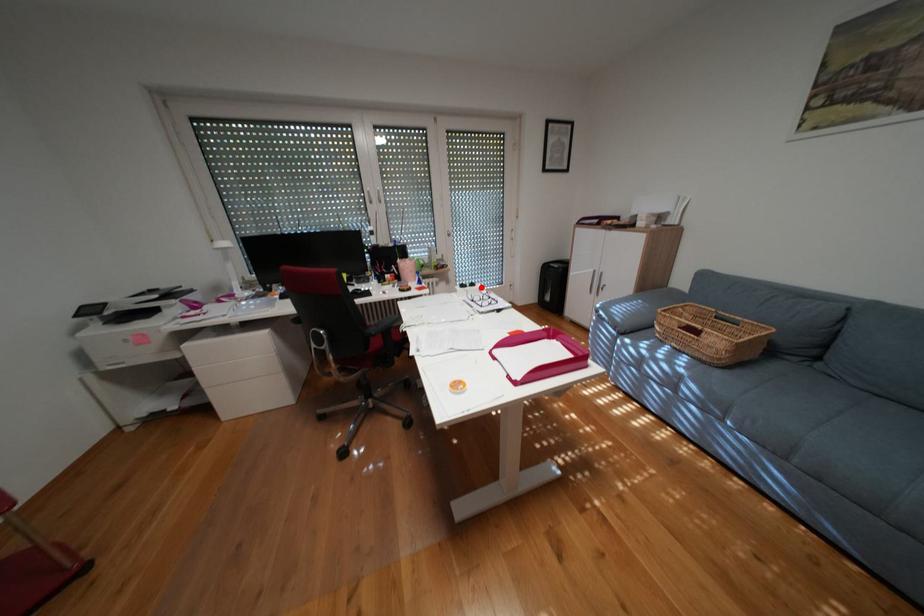
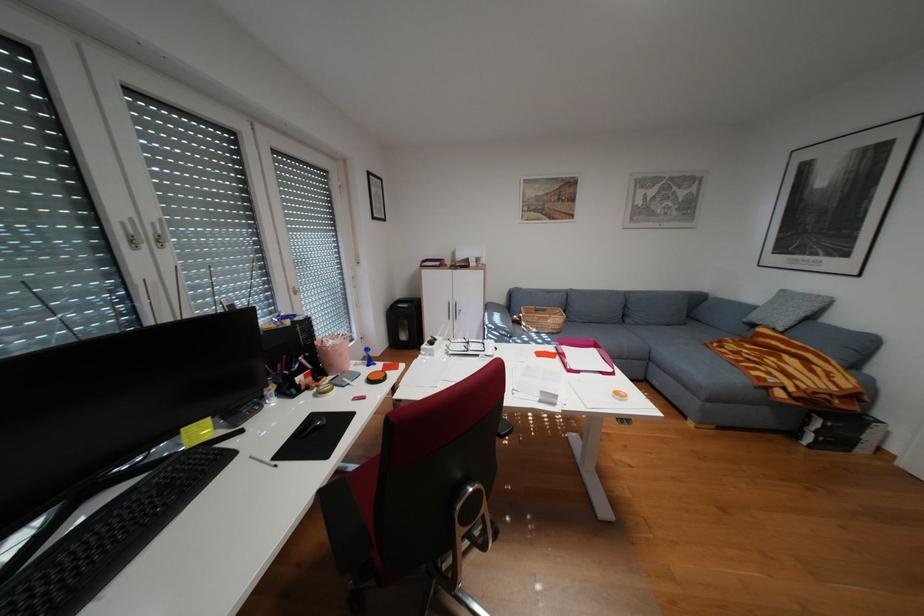
Locate, in the second image, the point that corresponds to the highlighted location in the first image.

(448, 342)